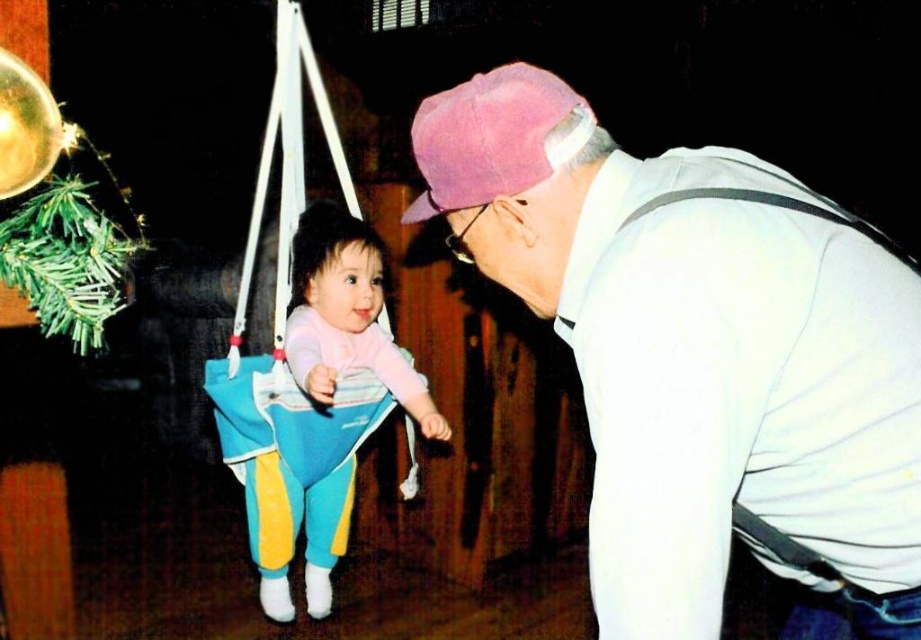
Can you confirm if white cotton shirt at upper right is bigger than pink fabric baseball cap at upper center?

Correct, white cotton shirt at upper right is larger in size than pink fabric baseball cap at upper center.

Is point (596, 193) more distant than point (476, 147)?

That is False.

This screenshot has height=640, width=921. I want to click on white cotton shirt at upper right, so click(x=698, y=356).

Between pastel pink fabric baby swing at center and pink fabric baseball cap at upper center, which one appears on the left side from the viewer's perspective?

From the viewer's perspective, pastel pink fabric baby swing at center appears more on the left side.

Is point (260, 461) farther from viewer compared to point (526, 132)?

Yes, point (260, 461) is behind point (526, 132).

Locate an element on the screen. The width and height of the screenshot is (921, 640). pastel pink fabric baby swing at center is located at coordinates (347, 316).

Does white cotton shirt at upper right have a lesser height compared to pastel pink fabric baby swing at center?

Incorrect, white cotton shirt at upper right's height does not fall short of pastel pink fabric baby swing at center's.

What do you see at coordinates (698, 356) in the screenshot? This screenshot has width=921, height=640. I see `white cotton shirt at upper right` at bounding box center [698, 356].

The image size is (921, 640). What do you see at coordinates (698, 356) in the screenshot?
I see `white cotton shirt at upper right` at bounding box center [698, 356].

This screenshot has height=640, width=921. I want to click on white cotton shirt at upper right, so click(698, 356).